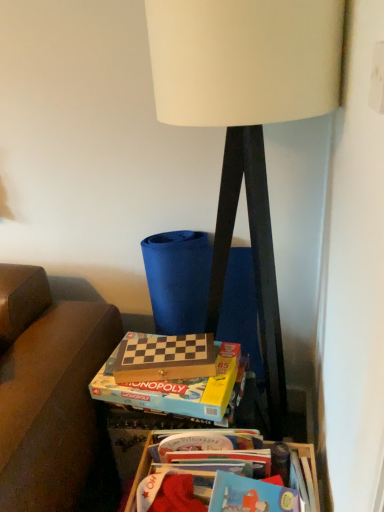
Question: Which direction should I rotate to face wooden chess set at center, the 1th paperback book in the front-to-back sequence, — up or down?

Choices:
 (A) down
 (B) up

Answer: (A)

Question: Is wooden chess set at lower center, which is the 2th paperback book from front to back, at the left side of wooden at lower right?

Choices:
 (A) no
 (B) yes

Answer: (B)

Question: Does wooden chess set at lower center, which is the 2th paperback book from front to back, have a smaller size compared to wooden at lower right?

Choices:
 (A) yes
 (B) no

Answer: (A)

Question: Considering the relative positions of wooden chess set at lower center, which appears as the first paperback book when viewed from the back, and wooden at lower right in the image provided, is wooden chess set at lower center, which appears as the first paperback book when viewed from the back, behind wooden at lower right?

Choices:
 (A) yes
 (B) no

Answer: (A)

Question: Can we say wooden chess set at lower center, which appears as the first paperback book when viewed from the back, lies outside wooden at lower right?

Choices:
 (A) yes
 (B) no

Answer: (A)

Question: Would you say wooden at lower right is part of wooden chess set at lower center, which is the 2th paperback book from front to back,'s contents?

Choices:
 (A) yes
 (B) no

Answer: (B)

Question: From the image's perspective, is wooden chess set at lower center, which appears as the first paperback book when viewed from the back, beneath wooden at lower right?

Choices:
 (A) yes
 (B) no

Answer: (B)

Question: Considering the relative positions of wooden chess set at center, which ranks as the 2th paperback book in back-to-front order, and wooden chess set at lower center, which appears as the first paperback book when viewed from the back, in the image provided, is wooden chess set at center, which ranks as the 2th paperback book in back-to-front order, to the right of wooden chess set at lower center, which appears as the first paperback book when viewed from the back, from the viewer's perspective?

Choices:
 (A) no
 (B) yes

Answer: (B)

Question: Is wooden chess set at lower center, which appears as the first paperback book when viewed from the back, surrounded by wooden chess set at center, which ranks as the 2th paperback book in back-to-front order?

Choices:
 (A) yes
 (B) no

Answer: (B)

Question: Does wooden chess set at center, the 1th paperback book in the front-to-back sequence, come behind wooden chess set at lower center, which is the 2th paperback book from front to back?

Choices:
 (A) yes
 (B) no

Answer: (B)

Question: Is wooden chess set at center, the 1th paperback book in the front-to-back sequence, shorter than wooden chess set at lower center, which appears as the first paperback book when viewed from the back?

Choices:
 (A) no
 (B) yes

Answer: (A)

Question: Can you confirm if wooden chess set at center, the 1th paperback book in the front-to-back sequence, is smaller than wooden chess set at lower center, which appears as the first paperback book when viewed from the back?

Choices:
 (A) yes
 (B) no

Answer: (B)

Question: Is wooden chess set at center, the 1th paperback book in the front-to-back sequence, taller than wooden chess set at lower center, which appears as the first paperback book when viewed from the back?

Choices:
 (A) yes
 (B) no

Answer: (A)

Question: From the image's perspective, does wooden chess set at lower center, which is the 2th paperback book from front to back, appear lower than white matte lamp at center?

Choices:
 (A) yes
 (B) no

Answer: (A)